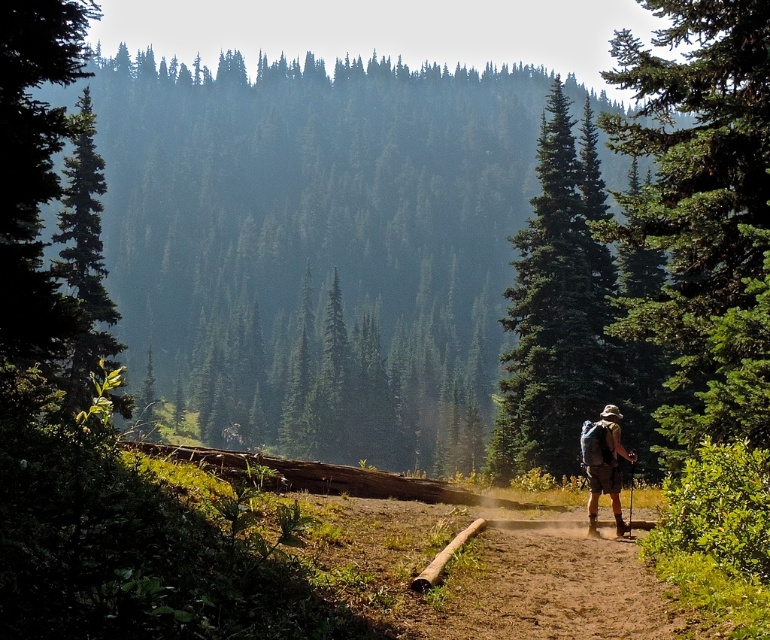
You are standing at the center of the dirt path in the forest. You see a point labeled as point (701, 216). What object is located at that point?

The point (701, 216) marks a green matte tree at right.

You are a hiker who wants to take a photo of the green matte tree at center and the camouflage fabric backpack at center. Since you want both objects to be clearly visible in the photo, which object should you focus on to ensure it appears in focus first?

The green matte tree at center is larger than the camouflage fabric backpack at center, so you should focus on the green matte tree at center first to ensure both are in focus.